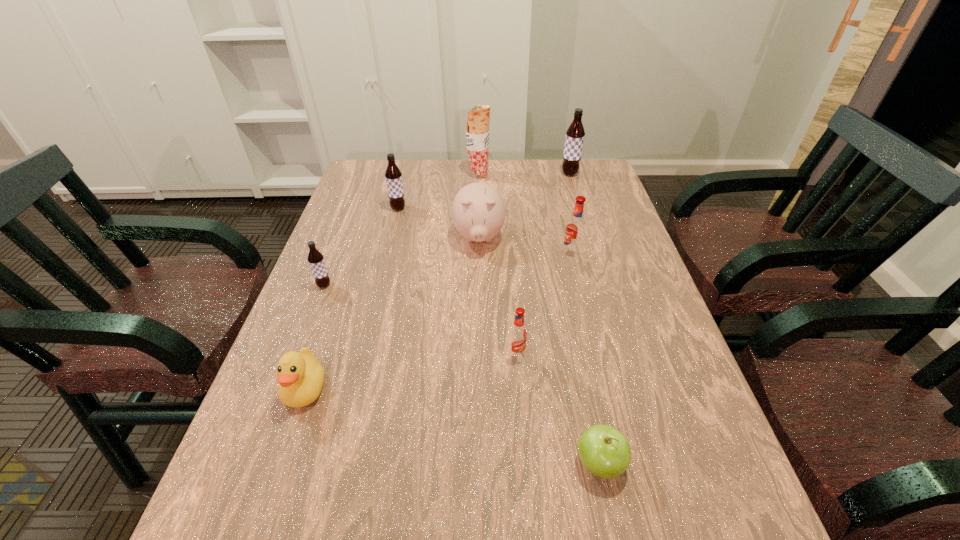
Locate an element on the screen. The width and height of the screenshot is (960, 540). blank area in the image that satisfies the following two spatial constraints: 1. on the front side of the third farthest root beer; 2. on the right side of the burrito is located at coordinates (478, 254).

This screenshot has width=960, height=540. What are the coordinates of `free space that satisfies the following two spatial constraints: 1. on the back side of the leftmost root beer; 2. on the left side of the fourth nearest root beer` in the screenshot? It's located at (353, 208).